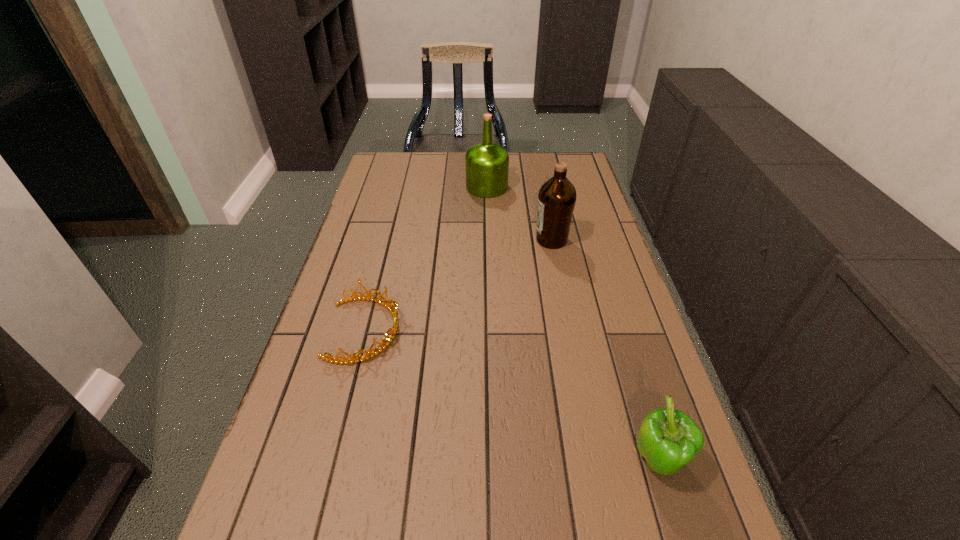
This screenshot has height=540, width=960. Identify the location of vacant space in between the bell pepper and the third nearest object. (605, 351).

Locate an element on the screen. unoccupied area between the left olive oil and the rightmost object is located at coordinates (572, 325).

At what (x,y) coordinates should I click in order to perform the action: click on free space between the shortest object and the third object from left to right. Please return your answer as a coordinate pair (x, y). Looking at the image, I should click on (458, 285).

Choose which object is the second nearest neighbor to the nearer olive oil. Please provide its 2D coordinates. Your answer should be formatted as a tuple, i.e. [(x, y)], where the tuple contains the x and y coordinates of a point satisfying the conditions above.

[(390, 307)]

Select which object is the third closest to the bell pepper. Please provide its 2D coordinates. Your answer should be formatted as a tuple, i.e. [(x, y)], where the tuple contains the x and y coordinates of a point satisfying the conditions above.

[(487, 163)]

Locate an element on the screen. vacant space that satisfies the following two spatial constraints: 1. on the label of the bell pepper; 2. on the right side of the right olive oil is located at coordinates (595, 462).

The width and height of the screenshot is (960, 540). Identify the location of blank area in the image that satisfies the following two spatial constraints: 1. on the front-facing side of the bell pepper; 2. on the left side of the tiara. (331, 462).

Where is `vacant region that satisfies the following two spatial constraints: 1. on the label of the right olive oil; 2. on the back side of the second shortest object`? The image size is (960, 540). vacant region that satisfies the following two spatial constraints: 1. on the label of the right olive oil; 2. on the back side of the second shortest object is located at coordinates (595, 462).

Locate an element on the screen. The height and width of the screenshot is (540, 960). vacant space that satisfies the following two spatial constraints: 1. on the label of the nearer olive oil; 2. on the right side of the rightmost object is located at coordinates (595, 462).

Locate an element on the screen. The width and height of the screenshot is (960, 540). blank space that satisfies the following two spatial constraints: 1. on the front-facing side of the leftmost object; 2. on the back side of the rightmost object is located at coordinates (331, 462).